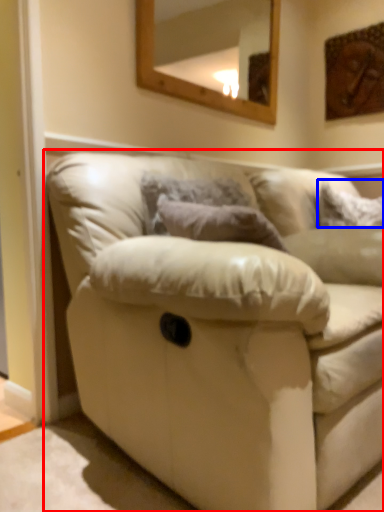
Question: Which object is further to the camera taking this photo, studio couch (highlighted by a red box) or pillow (highlighted by a blue box)?

Choices:
 (A) studio couch
 (B) pillow

Answer: (B)